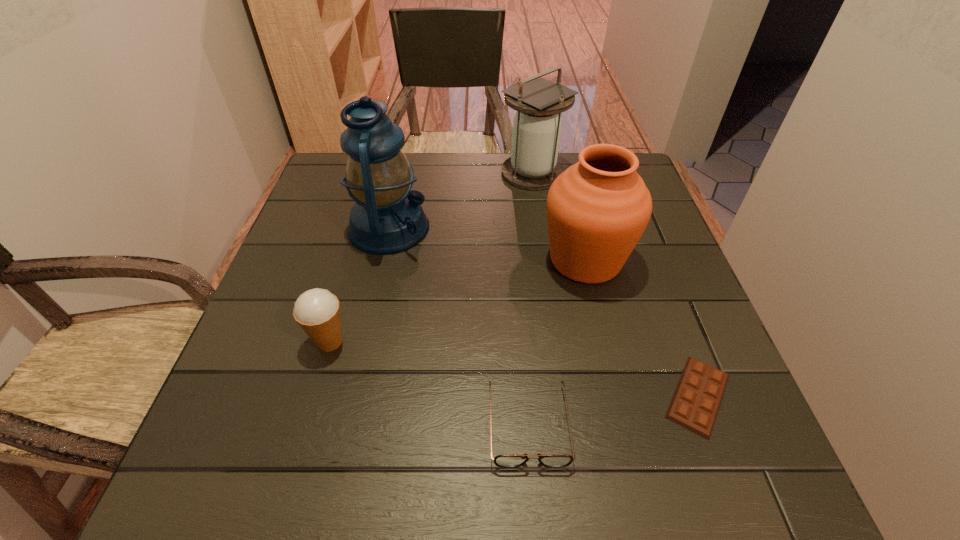
The height and width of the screenshot is (540, 960). What are the coordinates of `the nearer lantern` in the screenshot? It's located at (387, 217).

Locate an element on the screen. The height and width of the screenshot is (540, 960). the tallest object is located at coordinates click(387, 217).

I want to click on the farthest object, so click(533, 165).

The height and width of the screenshot is (540, 960). I want to click on the farther lantern, so click(x=533, y=165).

The height and width of the screenshot is (540, 960). I want to click on urn, so click(x=597, y=209).

I want to click on icecream, so click(317, 311).

I want to click on the fifth tallest object, so click(x=507, y=461).

Locate an element on the screen. chocolate bar is located at coordinates (696, 401).

I want to click on free space located 0.230m on the face of the taller lantern, so [522, 228].

You are a GUI agent. You are given a task and a screenshot of the screen. Output one action in this format:
    pyautogui.click(x=<x>, y=<y>)
    Task: Click on the free region located on the left of the shorter lantern
    The width and height of the screenshot is (960, 540).
    Given the screenshot: What is the action you would take?
    pyautogui.click(x=376, y=173)